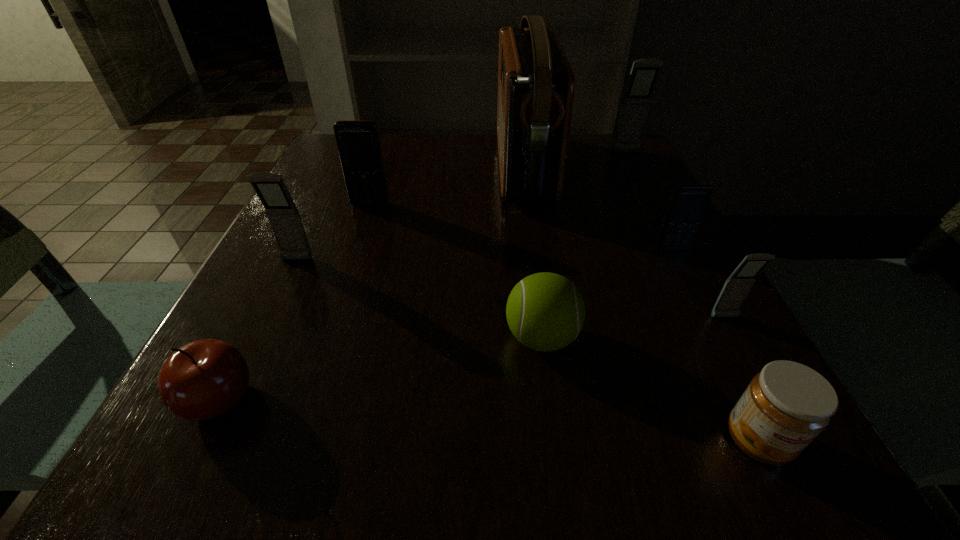
Locate an element on the screen. This screenshot has width=960, height=540. radio receiver is located at coordinates (536, 84).

Locate an element on the screen. The width and height of the screenshot is (960, 540). the tallest cellular telephone is located at coordinates (644, 74).

I want to click on the farthest cellular telephone, so click(x=644, y=74).

Locate an element on the screen. This screenshot has height=540, width=960. the fifth farthest object is located at coordinates (282, 213).

Where is `the leftmost gray cellular telephone`? Image resolution: width=960 pixels, height=540 pixels. the leftmost gray cellular telephone is located at coordinates (282, 213).

Where is `the fourth cellular telephone from right to left`? the fourth cellular telephone from right to left is located at coordinates (358, 142).

This screenshot has height=540, width=960. Identify the location of the bigger orange cellular telephone. (358, 142).

Find the location of a particular element. the right orange cellular telephone is located at coordinates (688, 202).

Identify the location of the smaller orange cellular telephone. The height and width of the screenshot is (540, 960). (688, 202).

This screenshot has height=540, width=960. What are the coordinates of `the nearest gray cellular telephone` in the screenshot? It's located at (736, 288).